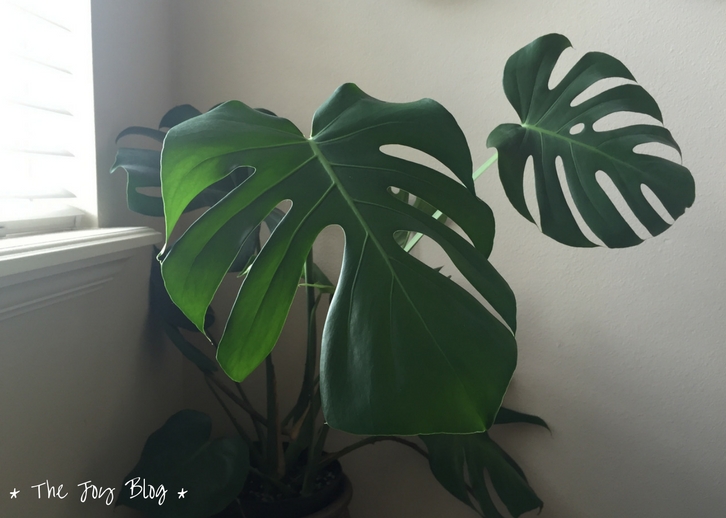
You are a GUI agent. You are given a task and a screenshot of the screen. Output one action in this format:
    pyautogui.click(x=<x>, y=<y>)
    Task: Click on the light
    Image resolution: width=726 pixels, height=518 pixels.
    Given the screenshot: What is the action you would take?
    pyautogui.click(x=12, y=181)